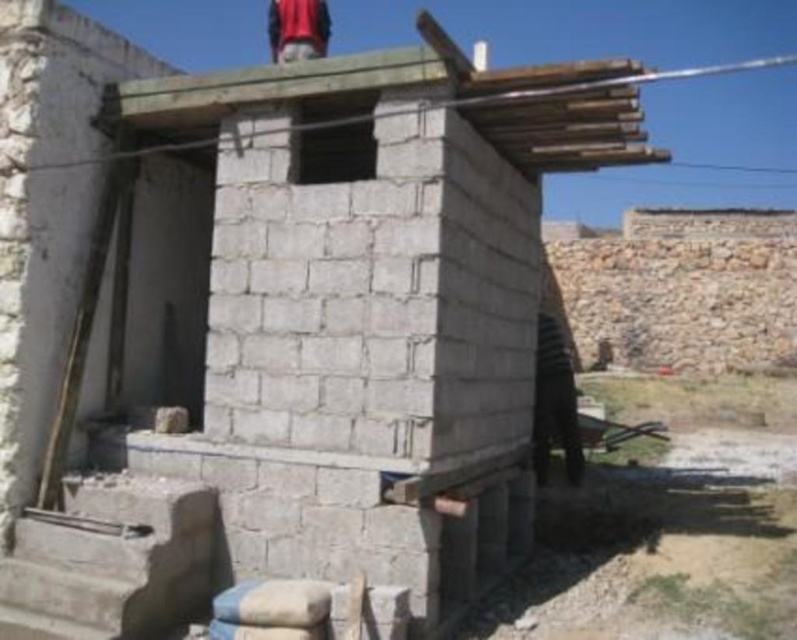
Question: Can you confirm if dark brown leather jacket at lower right is smaller than red fabric at upper center?

Choices:
 (A) no
 (B) yes

Answer: (B)

Question: Considering the real-world distances, which object is farthest from the smooth wooden boards at upper center?

Choices:
 (A) red fabric at upper center
 (B) dark brown leather jacket at lower right

Answer: (A)

Question: Which of the following is the farthest from the observer?

Choices:
 (A) (269, 0)
 (B) (570, 433)
 (C) (567, 116)

Answer: (A)

Question: Where is dark brown leather jacket at lower right located in relation to red fabric at upper center in the image?

Choices:
 (A) left
 (B) right

Answer: (B)

Question: Is dark brown leather jacket at lower right further to camera compared to red fabric at upper center?

Choices:
 (A) yes
 (B) no

Answer: (A)

Question: Which object appears farthest from the camera in this image?

Choices:
 (A) dark brown leather jacket at lower right
 (B) smooth wooden boards at upper center

Answer: (A)